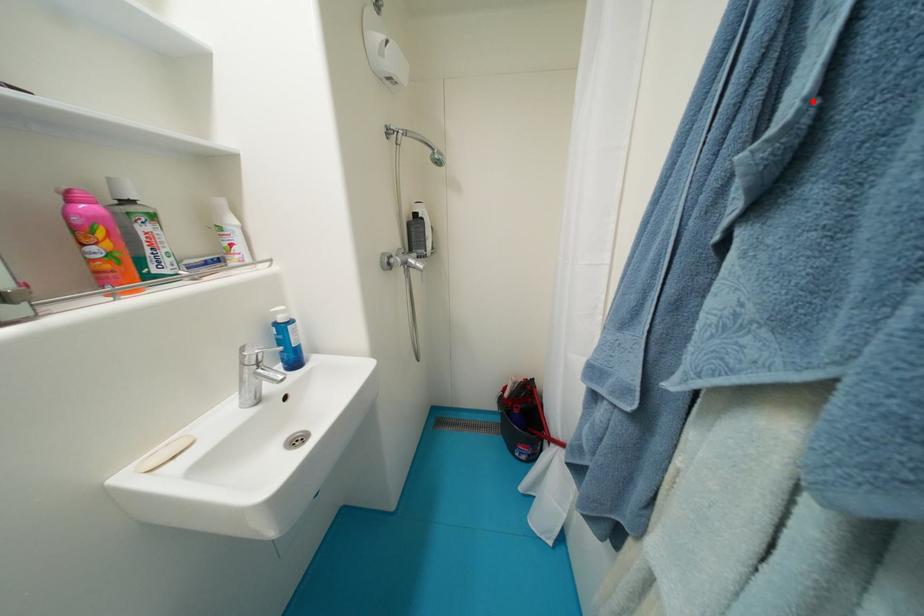
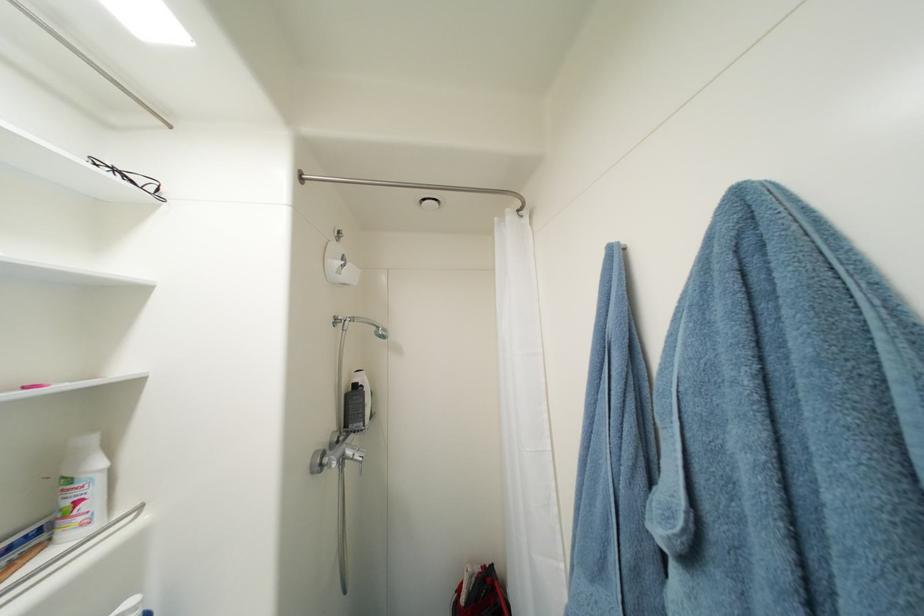
Question: I am providing you with two images of the same scene from different viewpoints. A red point is marked on the first image. Can you still see the location of the red point in image 2?

Choices:
 (A) Yes
 (B) No

Answer: (A)